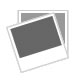
Where is `area below polaroids`? area below polaroids is located at coordinates (37, 73).